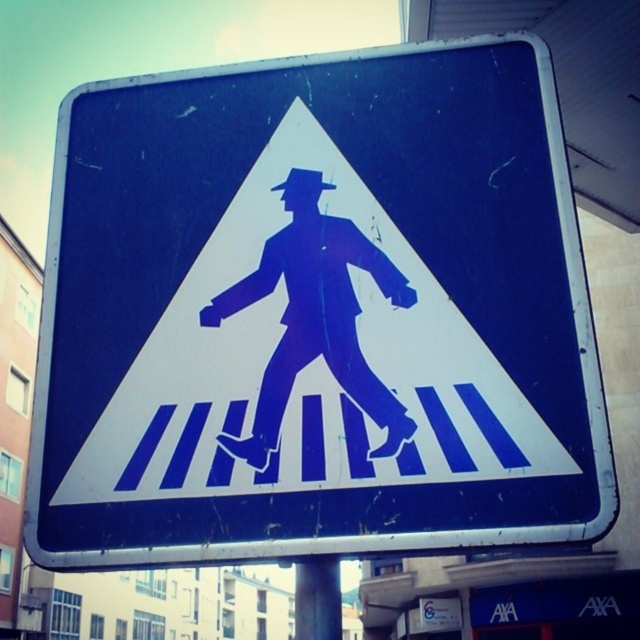
Can you confirm if blue matte pedestrian at center is positioned below metallic gray pole at lower center?

No.

Which is behind, point (387, 273) or point (301, 586)?

The point (387, 273) is behind.

Is point (296, 234) less distant than point (326, 621)?

That is False.

The image size is (640, 640). What are the coordinates of `blue matte pedestrian at center` in the screenshot? It's located at (314, 316).